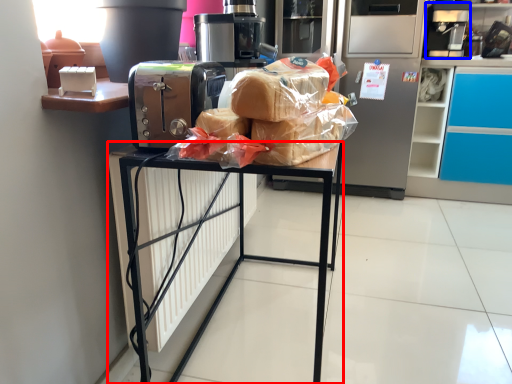
Question: Which of the following is the farthest to the observer, furniture (highlighted by a red box) or coffee machine (highlighted by a blue box)?

Choices:
 (A) furniture
 (B) coffee machine

Answer: (B)